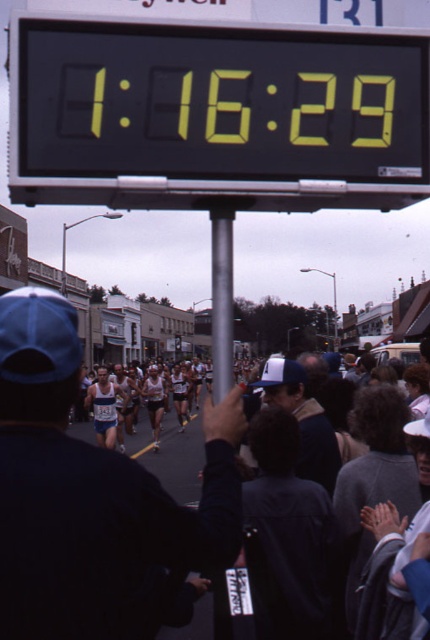
Between yellow digital display at upper center and silver metallic pole at center, which one is positioned higher?

yellow digital display at upper center

What do you see at coordinates (215, 113) in the screenshot? I see `yellow digital display at upper center` at bounding box center [215, 113].

Where is `yellow digital display at upper center`? yellow digital display at upper center is located at coordinates (215, 113).